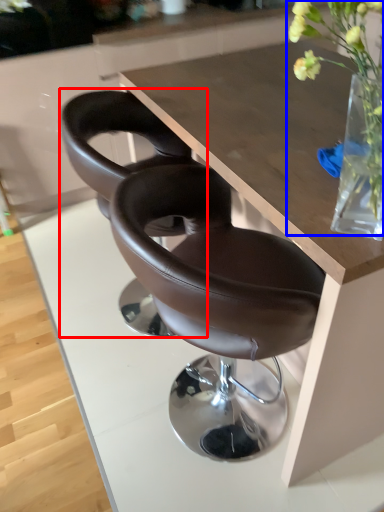
Question: Which object appears closest to the camera in this image, chair (highlighted by a red box) or floral arrangement (highlighted by a blue box)?

Choices:
 (A) chair
 (B) floral arrangement

Answer: (B)